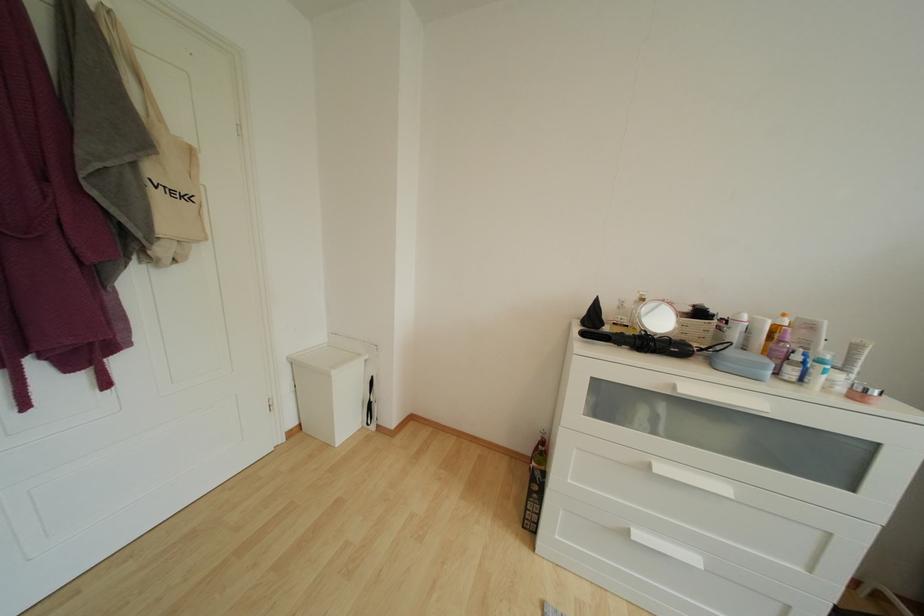
Where would you lift the pink jar lid? Please return your answer as a coordinate pair (x, y).

(862, 392)